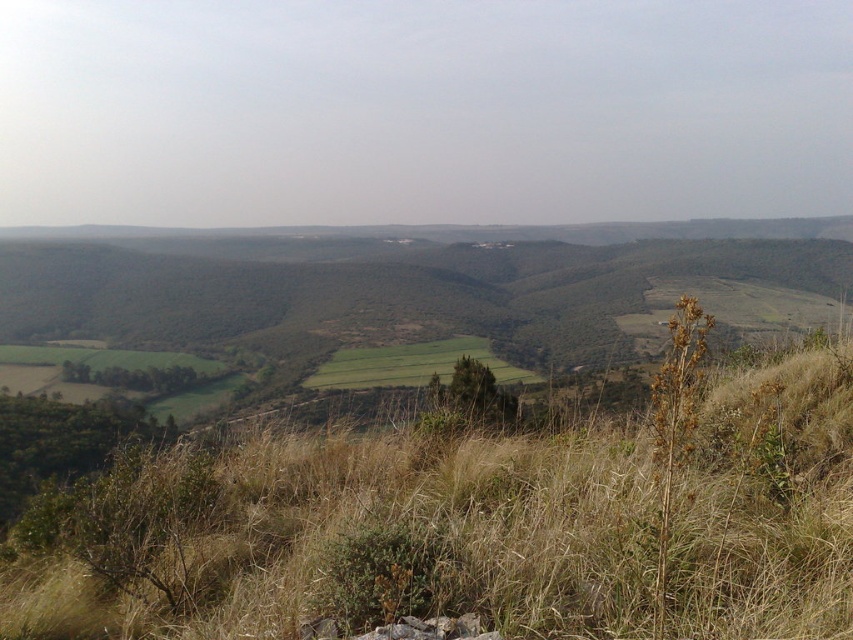
You are standing at the top of a hill overlooking the landscape. You notice both the brown dry grass at center and the green grassy field at center. Which one is located lower in the scene?

The brown dry grass at center is located below the green grassy field at center, so it is lower in the scene.

From the picture: You are standing at the point labeled as point (x=473, y=524) in the image. Based on the scene description, what type of terrain are you currently standing on?

The point (x=473, y=524) is on brown dry grass at center, so you are standing on dry, golden brown grasses in a semi arid environment.